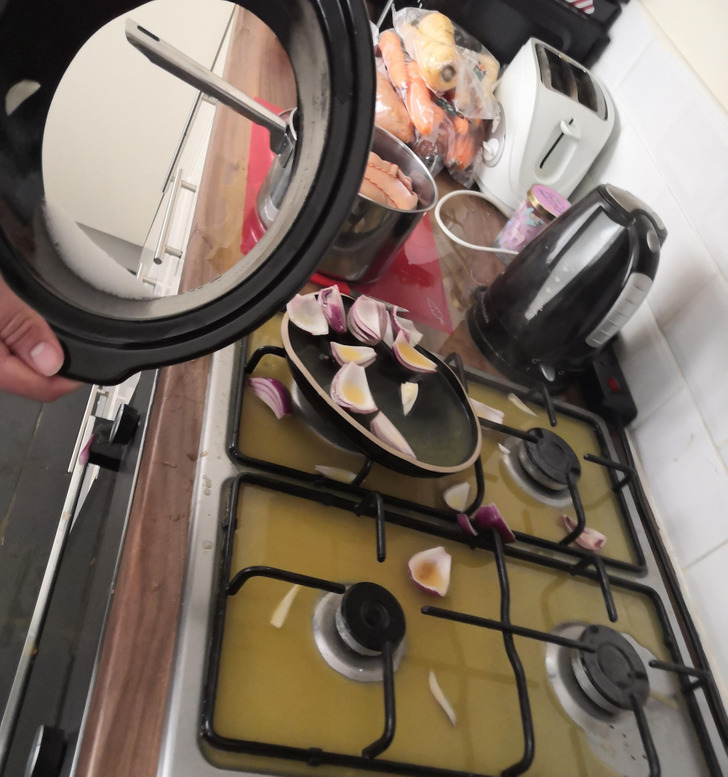
This screenshot has height=777, width=728. Find the location of `yellow wall`. yellow wall is located at coordinates (702, 43).